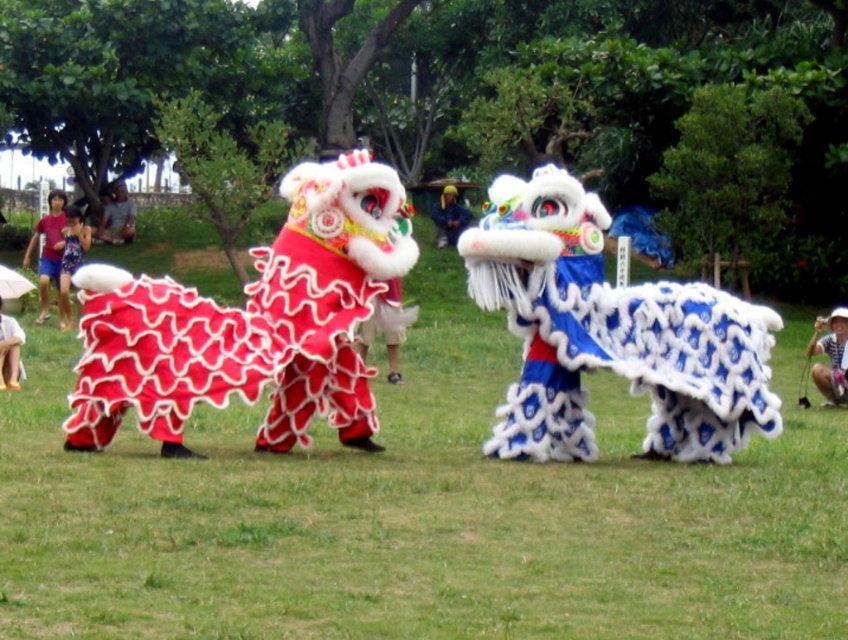
You are a photographer at the event and need to capture both blue denim shorts at lower left and blue denim shorts at left in a single frame. Which one should you position closer to the center of your camera viewfinder to ensure both are visible?

To ensure both blue denim shorts at lower left and blue denim shorts at left are visible, position the blue denim shorts at lower left closer to the center since it is to the right of blue denim shorts at left, allowing the camera to capture both in the frame.